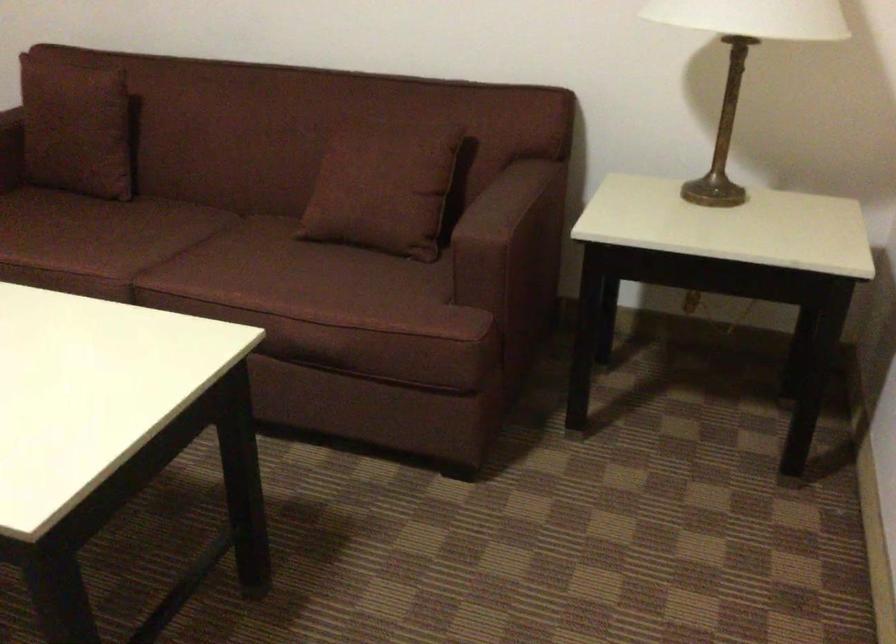
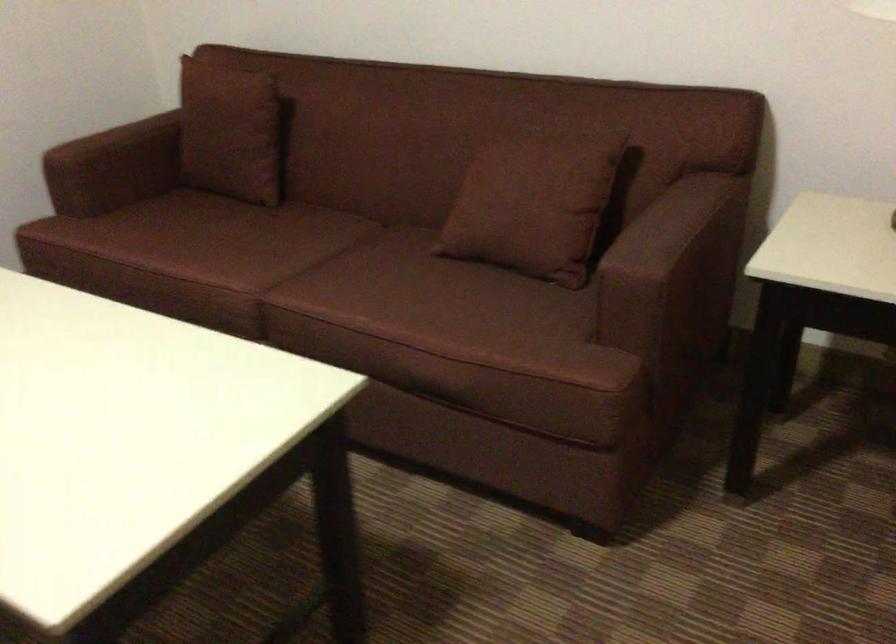
Question: The images are taken continuously from a first-person perspective. In which direction is your viewpoint rotating?

Choices:
 (A) Left
 (B) Right
 (C) Up
 (D) Down

Answer: (A)